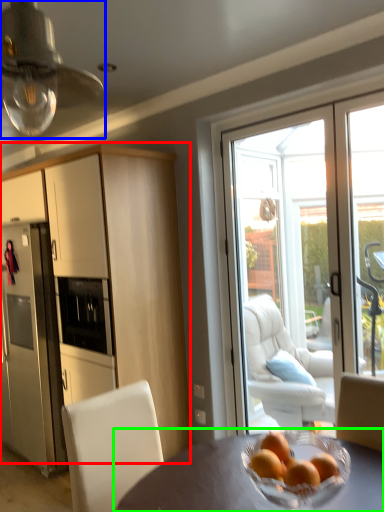
Question: Based on their relative distances, which object is farther from cabinetry (highlighted by a red box)? Choose from light fixture (highlighted by a blue box) and table (highlighted by a green box).

Choices:
 (A) light fixture
 (B) table

Answer: (B)